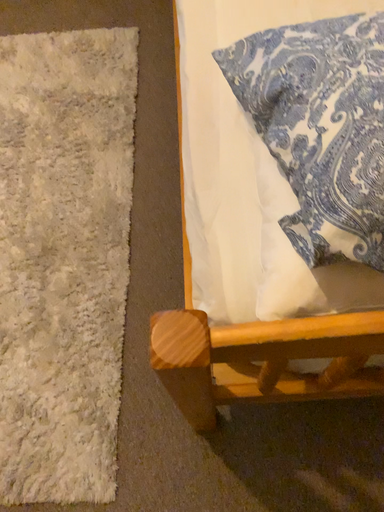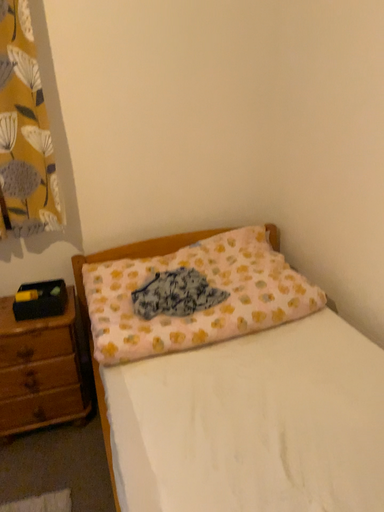
Question: How did the camera likely rotate when shooting the video?

Choices:
 (A) rotated left
 (B) rotated right

Answer: (B)